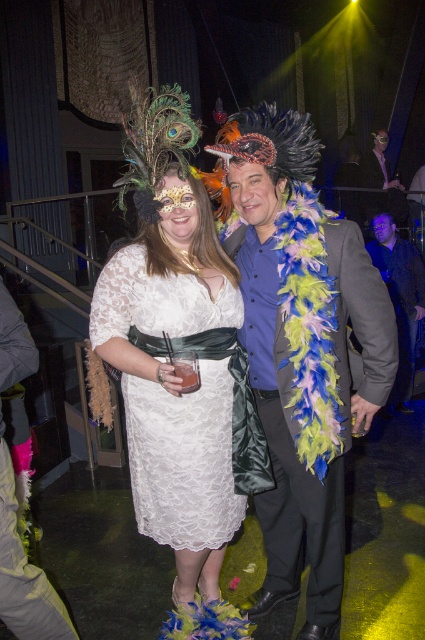
You are a photographer at the event and want to capture both the shiny blue feather boa at center and the shiny black jacket at upper right in a single photo. Which object should you focus on first to ensure both are in clear focus?

You should focus on the shiny blue feather boa at center first because it is closer to the viewer than the shiny black jacket at upper right. By focusing on the closer object, the depth of field may still keep the shiny black jacket at upper right in acceptable focus.

You are a photographer at the event and want to capture both the shiny blue feather boa at center and the dark gray fabric jacket at right in a single shot. Since you can only focus on one subject at a time, which one should you focus on to ensure the other appears in the background?

You should focus on the shiny blue feather boa at center because it is in front of the dark gray fabric jacket at right, so if you focus on it, the jacket will naturally be in the background.

You are at a party and want to hand a drink to the person wearing the shiny blue feather boa at center and the dark gray fabric jacket at right. Which person should you approach first if you are standing in the center of the room?

You should approach the shiny blue feather boa at center first because it is to the left of the dark gray fabric jacket at right, so it is closer to the center of the room.